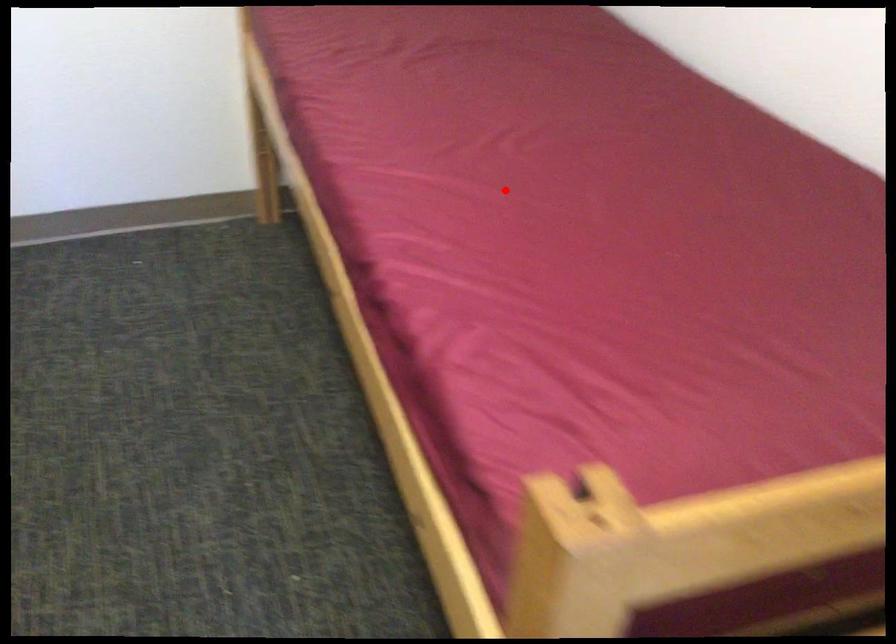
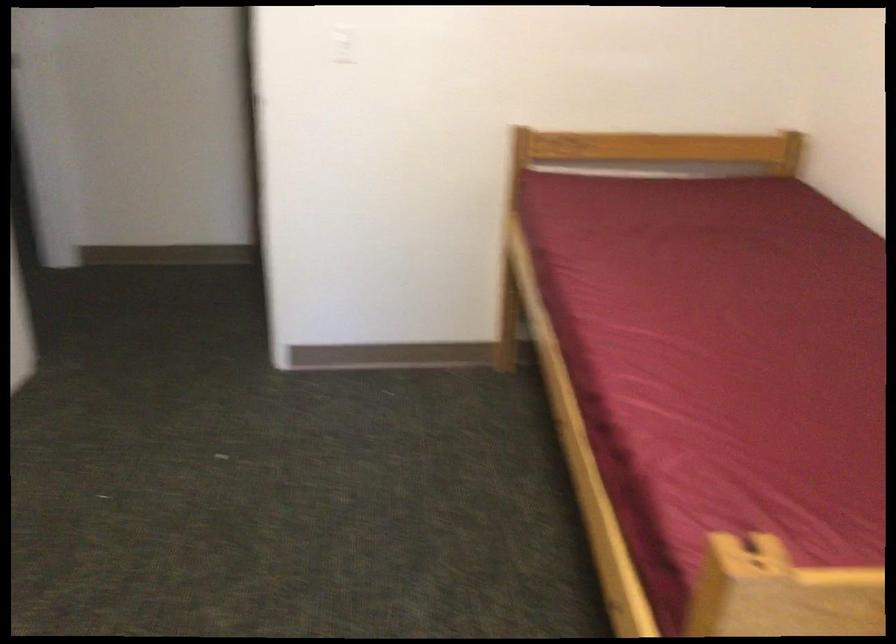
Find the pixel in the second image that matches the highlighted location in the first image.

(719, 348)